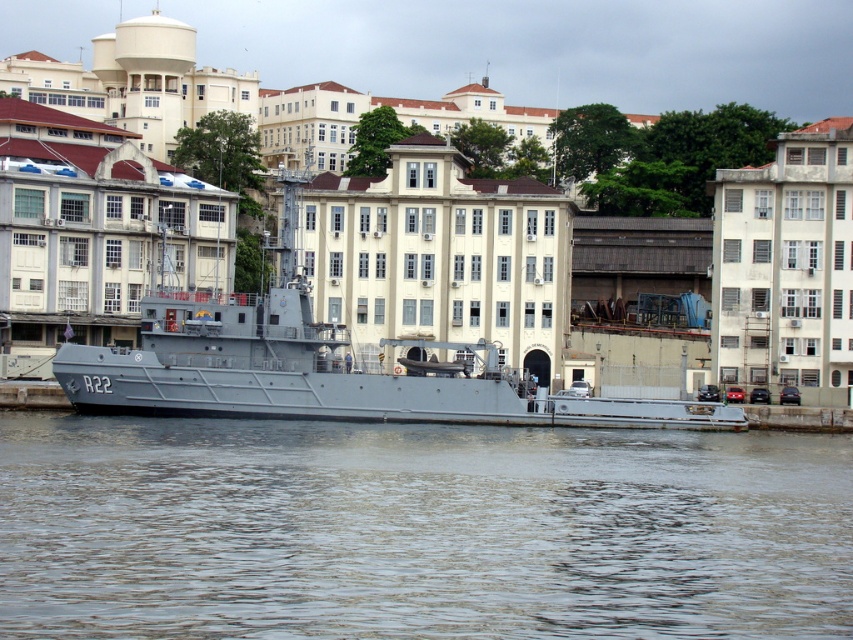
You are a sailor on the gray matte boat at center. You notice a floating object in the gray water at center. To reach it, should you move towards your left or right side?

The gray water at center is to the right of gray matte boat at center, so you should move towards your right side to reach the floating object in the gray water at center.

You are a sailor on the pier and need to board the gray matte boat at center. The gray water at center is between you and the boat. Can you step onto the boat directly from the pier without getting your feet wet?

The gray water at center is smaller than the gray matte boat at center, so the boat is larger and covers more of the area. Since the water is smaller, it might not fully surround the boat. You can likely step onto the boat directly from the pier without getting your feet wet.